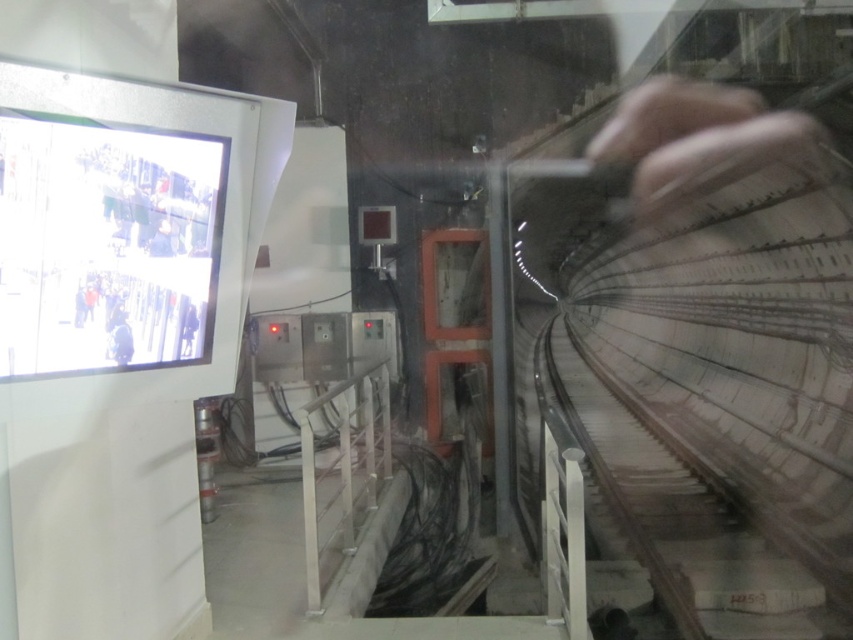
Question: Which point appears closest to the camera in this image?

Choices:
 (A) (144, 221)
 (B) (611, 410)

Answer: (A)

Question: Does smooth concrete train track at right appear on the right side of light gray fabric jacket at left?

Choices:
 (A) no
 (B) yes

Answer: (B)

Question: Which object appears closest to the camera in this image?

Choices:
 (A) smooth concrete train track at right
 (B) light gray fabric jacket at left

Answer: (B)

Question: Can you confirm if smooth concrete train track at right is wider than light gray fabric jacket at left?

Choices:
 (A) no
 (B) yes

Answer: (B)

Question: From the image, what is the correct spatial relationship of smooth concrete train track at right in relation to light gray fabric jacket at left?

Choices:
 (A) above
 (B) below

Answer: (B)